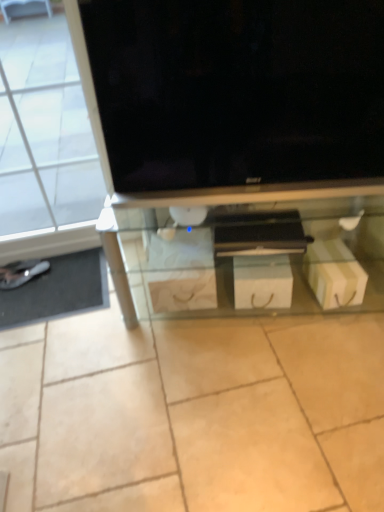
Question: Is black glossy tv at upper center outside of white cardboard box at lower right?

Choices:
 (A) yes
 (B) no

Answer: (A)

Question: From a real-world perspective, is black glossy tv at upper center below white cardboard box at lower right?

Choices:
 (A) yes
 (B) no

Answer: (B)

Question: From the image's perspective, is black glossy tv at upper center under white cardboard box at lower right?

Choices:
 (A) no
 (B) yes

Answer: (A)

Question: Considering the relative positions of black glossy tv at upper center and white cardboard box at lower right in the image provided, is black glossy tv at upper center behind white cardboard box at lower right?

Choices:
 (A) yes
 (B) no

Answer: (B)

Question: Considering the relative sizes of black glossy tv at upper center and white cardboard box at lower right in the image provided, is black glossy tv at upper center bigger than white cardboard box at lower right?

Choices:
 (A) no
 (B) yes

Answer: (B)

Question: Is black glossy tv at upper center at the right side of white cardboard box at lower right?

Choices:
 (A) no
 (B) yes

Answer: (A)

Question: Is white cardboard box at lower right at the back of metallic silver flat at lower left?

Choices:
 (A) yes
 (B) no

Answer: (B)

Question: Does metallic silver flat at lower left have a lesser height compared to white cardboard box at lower right?

Choices:
 (A) yes
 (B) no

Answer: (A)

Question: From a real-world perspective, is metallic silver flat at lower left on top of white cardboard box at lower right?

Choices:
 (A) yes
 (B) no

Answer: (B)

Question: Is metallic silver flat at lower left at the left side of white cardboard box at lower right?

Choices:
 (A) yes
 (B) no

Answer: (A)

Question: Is metallic silver flat at lower left positioned behind white cardboard box at lower right?

Choices:
 (A) yes
 (B) no

Answer: (A)

Question: Is metallic silver flat at lower left completely or partially outside of white cardboard box at lower right?

Choices:
 (A) yes
 (B) no

Answer: (A)

Question: Does white cardboard drawer at center lie behind transparent glass shelf at center?

Choices:
 (A) yes
 (B) no

Answer: (A)